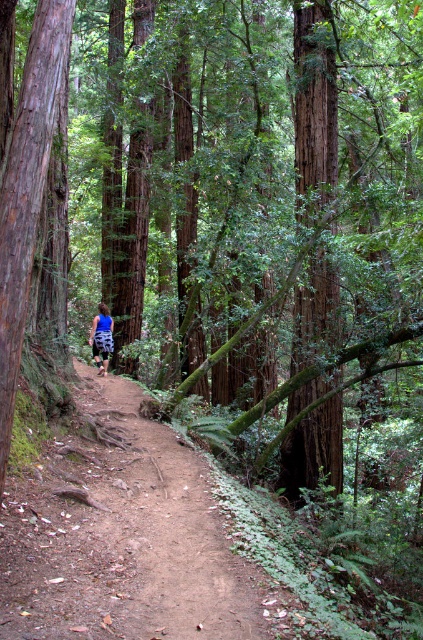
You are a hiker standing on the dirt path at center and see the blue printed shorts at center ahead. Which object is closer to you? Please explain your reasoning based on the scene description.

The dirt path at center is closer to you because it is in front of the blue printed shorts at center, meaning the shorts are behind the path from your perspective.

You are a hiker standing at the center of the image. You see the dirt path at center and the blue printed shorts at center. Which object is located more to the right side?

The dirt path at center is positioned on the right side of blue printed shorts at center, so the dirt path at center is more to the right side.